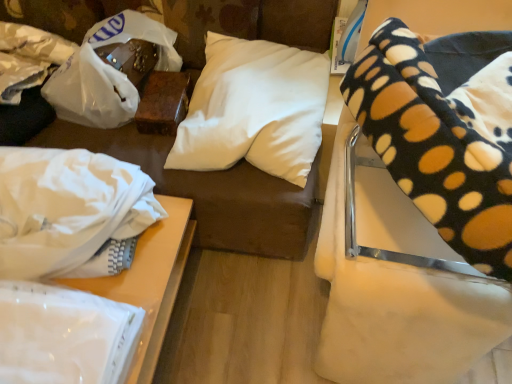
Question: Is white fabric at lower left far from white glossy paper at lower left?

Choices:
 (A) no
 (B) yes

Answer: (A)

Question: Would you say white glossy paper at lower left is part of white fabric at lower left's contents?

Choices:
 (A) no
 (B) yes

Answer: (A)

Question: From the image's perspective, does white fabric at lower left appear lower than white glossy paper at lower left?

Choices:
 (A) no
 (B) yes

Answer: (B)

Question: Is white fabric at lower left smaller than white glossy paper at lower left?

Choices:
 (A) yes
 (B) no

Answer: (B)

Question: Considering the relative positions of white fabric at lower left and white glossy paper at lower left in the image provided, is white fabric at lower left behind white glossy paper at lower left?

Choices:
 (A) yes
 (B) no

Answer: (A)

Question: Is white fabric at lower left at the left side of white glossy paper at lower left?

Choices:
 (A) yes
 (B) no

Answer: (B)

Question: Does white glossy paper at lower left have a greater width compared to white fabric at left?

Choices:
 (A) no
 (B) yes

Answer: (A)

Question: Considering the relative sizes of white glossy paper at lower left and white fabric at left in the image provided, is white glossy paper at lower left taller than white fabric at left?

Choices:
 (A) no
 (B) yes

Answer: (A)

Question: From the image's perspective, is white glossy paper at lower left located beneath white fabric at left?

Choices:
 (A) yes
 (B) no

Answer: (A)

Question: Does white glossy paper at lower left have a smaller size compared to white fabric at left?

Choices:
 (A) no
 (B) yes

Answer: (B)

Question: From a real-world perspective, is white glossy paper at lower left positioned under white fabric at left based on gravity?

Choices:
 (A) no
 (B) yes

Answer: (B)

Question: Is white glossy paper at lower left positioned with its back to white fabric at left?

Choices:
 (A) no
 (B) yes

Answer: (B)

Question: Is white fabric at lower left facing towards black polka dot blanket at upper right?

Choices:
 (A) no
 (B) yes

Answer: (A)